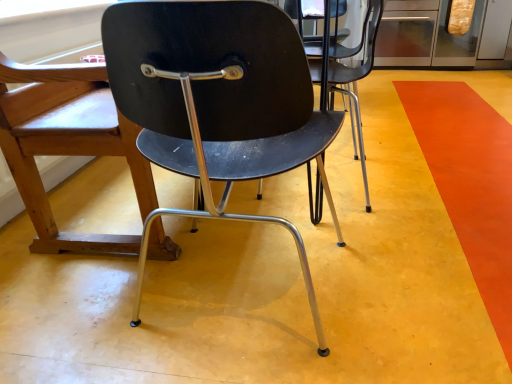
Where is `free location to the right of matte black chair at center, which is the 1th chair in back-to-front order`? The image size is (512, 384). free location to the right of matte black chair at center, which is the 1th chair in back-to-front order is located at coordinates (374, 172).